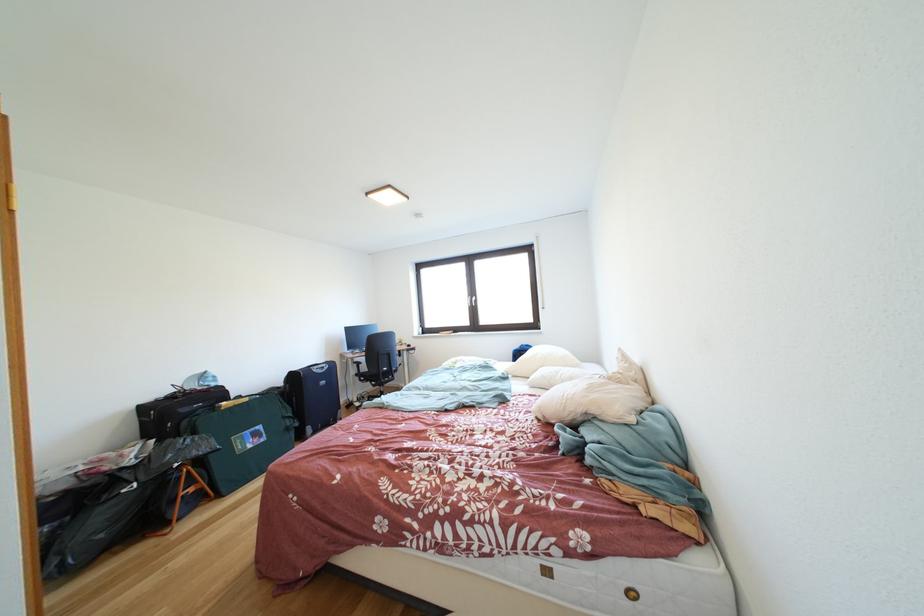
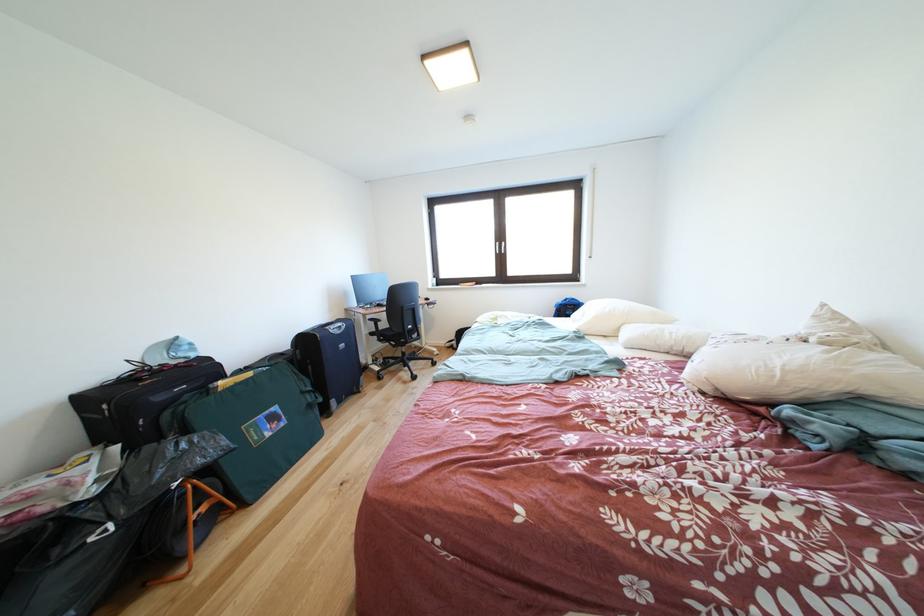
Where in the second image is the point corresponding to [549,421] from the first image?

(716, 394)